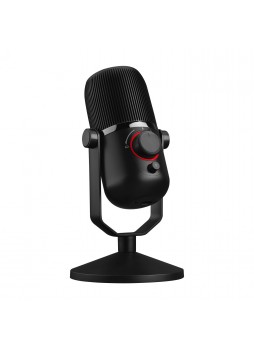
This screenshot has width=254, height=348. What are the coordinates of `mic holder` in the screenshot? It's located at 94,188, 123,237, 155,215.